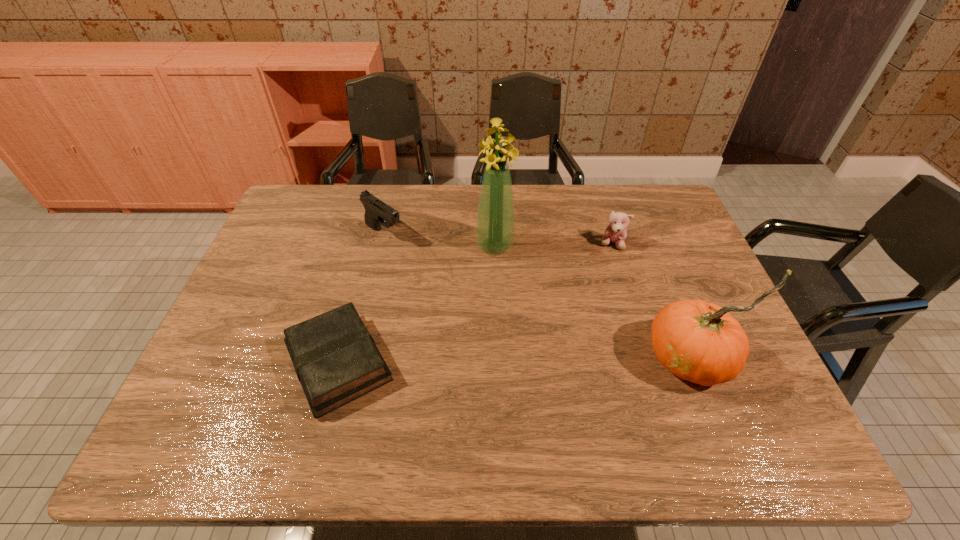
You are a GUI agent. You are given a task and a screenshot of the screen. Output one action in this format:
    pyautogui.click(x=<x>, y=<y>)
    Task: Click on the vacant space on the desktop that is between the shortest object and the pumpkin and is positioned on the front-facing side of the bouquet
    The image size is (960, 540).
    Given the screenshot: What is the action you would take?
    pyautogui.click(x=526, y=361)

Identify the location of vacant space on the desktop that is between the book and the second tallest object and is positioned at the face of the teddy bear. This screenshot has width=960, height=540. (505, 361).

In order to click on free space on the desktop that is between the book and the fourth shortest object and is positioned at the barrel of the pistol in this screenshot , I will do `click(557, 360)`.